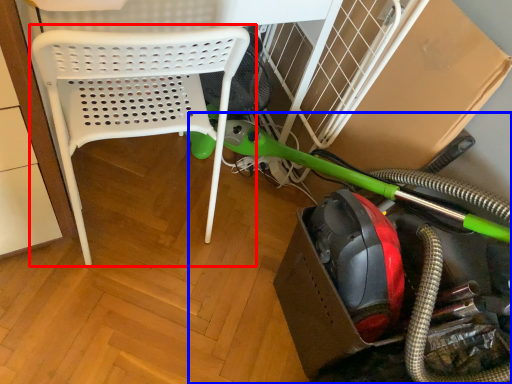
Question: Which point is closer to the camera, chair (highlighted by a red box) or garden hose (highlighted by a blue box)?

Choices:
 (A) chair
 (B) garden hose

Answer: (B)